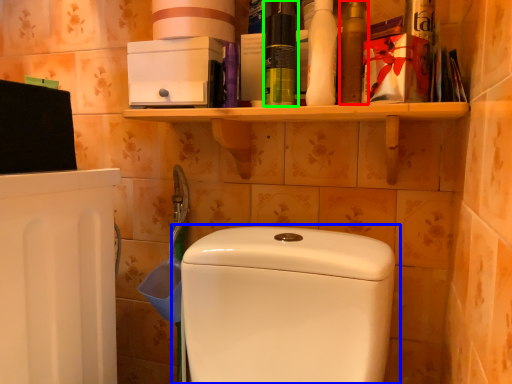
Question: Which is nearer to the mouthwash (highlighted by a red box)? toilet (highlighted by a blue box) or cleaning product (highlighted by a green box).

Choices:
 (A) toilet
 (B) cleaning product

Answer: (B)